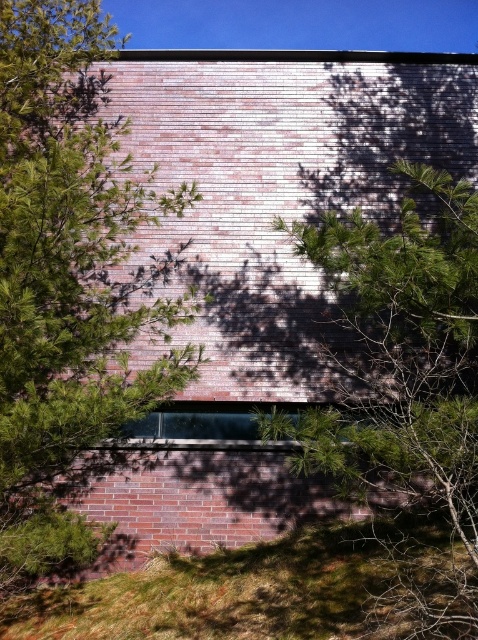
Between point (64, 401) and point (423, 186), which one is positioned in front?

Point (423, 186) is in front.

Can you confirm if green leafy tree at left is shorter than green leafy tree at center?

Yes.

Does point (47, 180) come behind point (271, 426)?

Yes, it is behind point (271, 426).

Find the location of a particular element. This screenshot has width=478, height=640. green leafy tree at left is located at coordinates (66, 284).

Looking at this image, is the position of green leafy tree at center more distant than that of green grass at lower center?

No.

Does green leafy tree at center have a lesser height compared to green grass at lower center?

Incorrect, green leafy tree at center's height does not fall short of green grass at lower center's.

The image size is (478, 640). Find the location of `green leafy tree at center`. green leafy tree at center is located at coordinates (404, 387).

Between green leafy tree at left and green grass at lower center, which one appears on the right side from the viewer's perspective?

Positioned to the right is green grass at lower center.

Can you confirm if green leafy tree at left is positioned above green grass at lower center?

Yes.

Is point (130, 419) behind point (111, 604)?

No, (130, 419) is closer to viewer.

At what (x,y) coordinates should I click in order to perform the action: click on green leafy tree at left. Please return your answer as a coordinate pair (x, y). Looking at the image, I should click on [x=66, y=284].